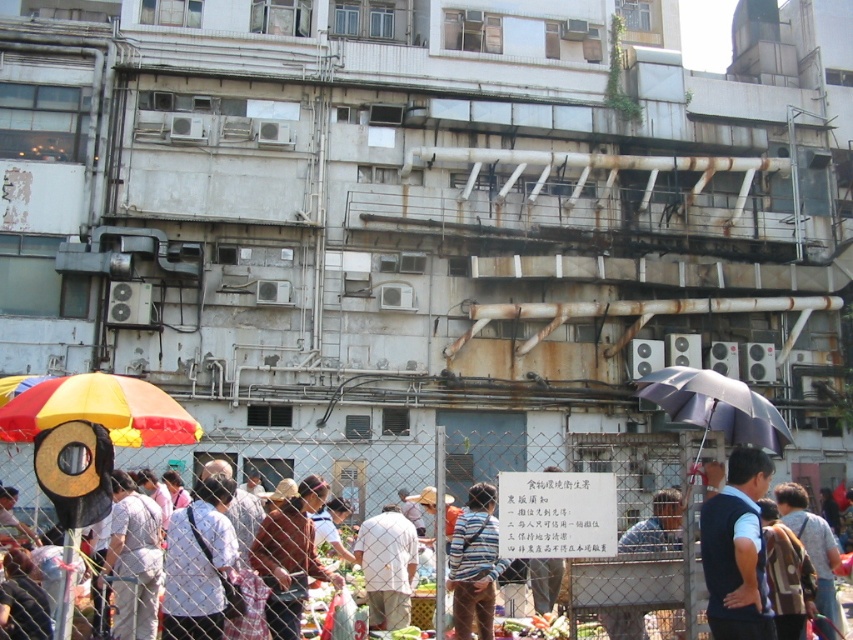
Based on the photo, you are standing at the camera position and want to hand a brochure to the person wearing the dark blue vest at center. Can you reach them without moving from your current spot?

The dark blue vest at center is 15.15 meters away from the camera, so you cannot reach them without moving from your current spot.

You are a customer at the market and want to reach the fruit and vegetable stall. You are currently standing at point [677,493]. There is another customer at point [471,435]. Which customer is closer to the stall?

The customer at point [471,435] is closer to the stall because point [471,435] is behind point [677,493], meaning it is closer to the stall.

You are a photographer trying to capture a clear shot of the dark blue vest at center and the white cotton shirt at center. Since you want both to be visible, which clothing item should you focus on first to ensure depth of field?

The dark blue vest at center is thinner than the white cotton shirt at center, so focusing on the dark blue vest at center first would ensure both are in focus as it is closer to the camera.